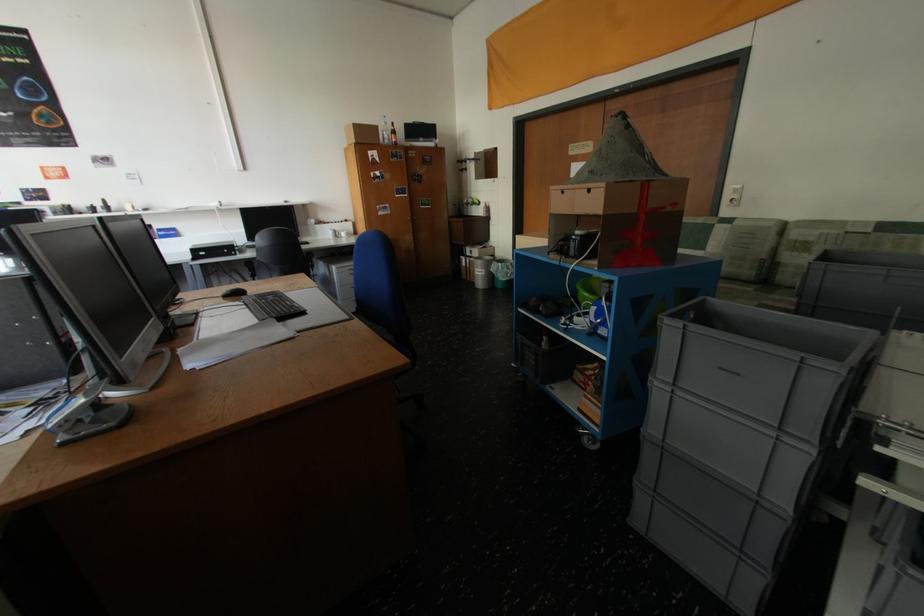
Find the location of a particular element. The width and height of the screenshot is (924, 616). cardboard box is located at coordinates (610, 201).